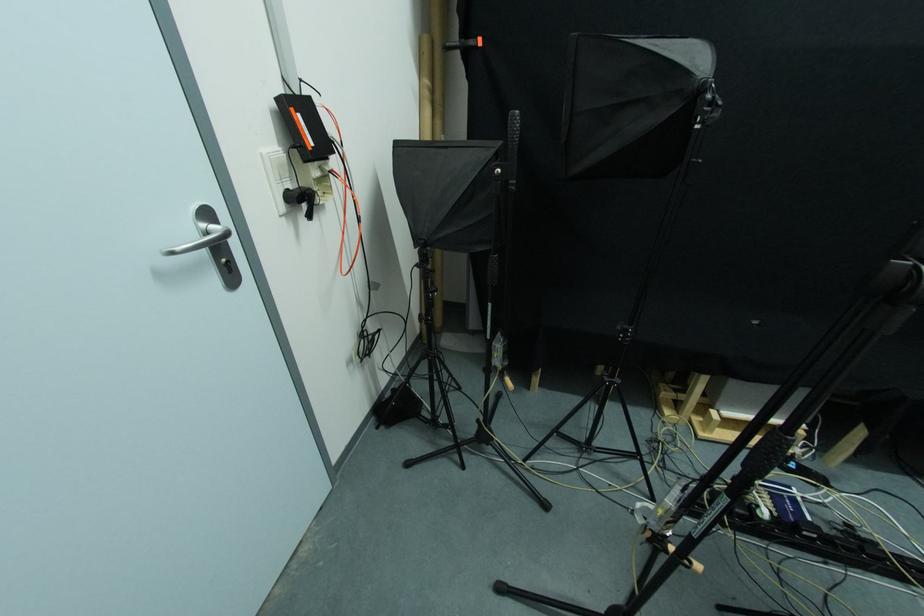
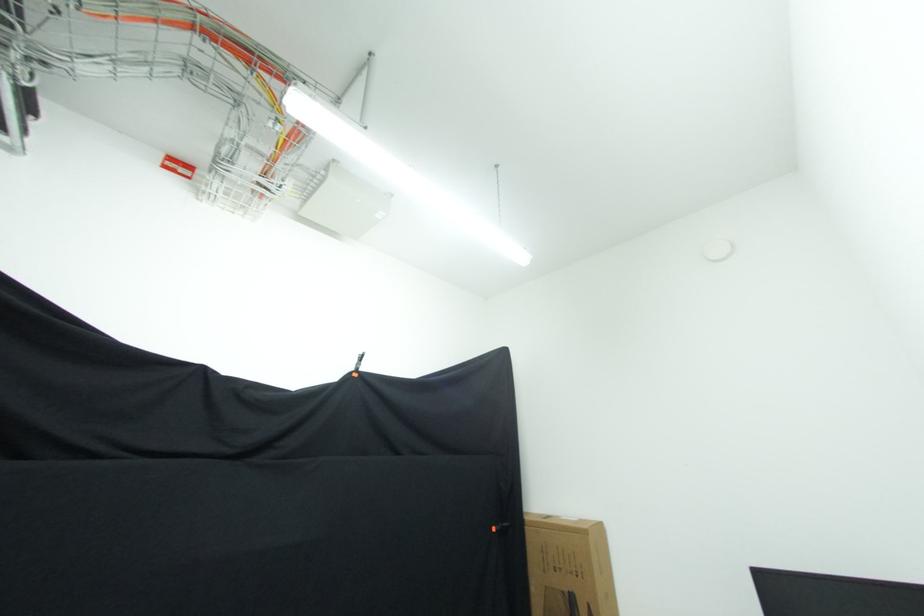
First-person continuous shooting, in which direction is the camera rotating?

The camera rotated toward right-up.